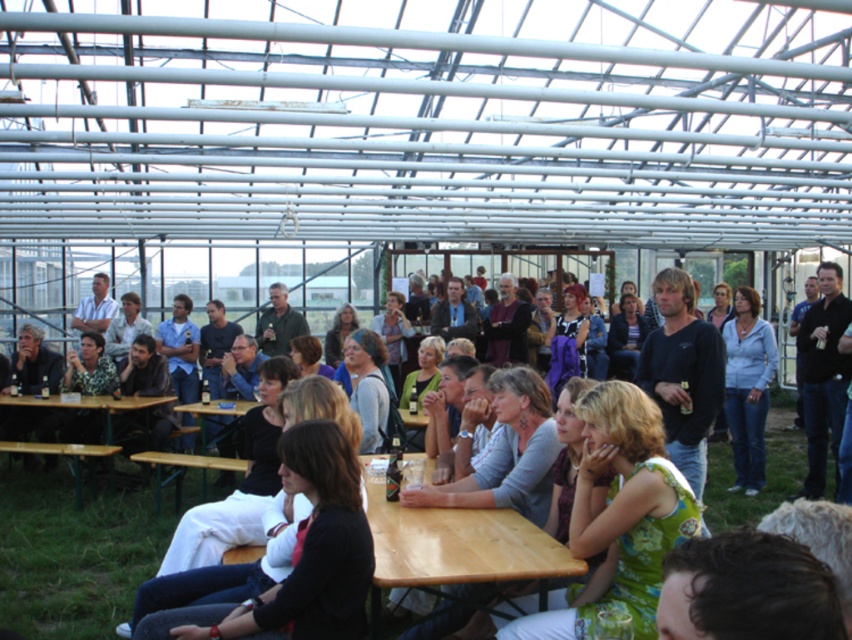
You are a server carrying a tray of drinks. You need to walk from the entrance of the structure to the wooden table at center. The path is clear except for a 2.5 meter wide flower bed. Can you reach the table without stepping into the flower bed?

The distance between the entrance and the wooden table at center is 2.63 meters. Since the flower bed is 2.5 meters wide, you can navigate around it and still reach the table.

You are a photographer standing at the back of the gathering area. You want to take a photo that includes both the wooden table at center and the wooden picnic table at lower left. Which table should you move closer to in order to capture both in focus without adjusting your camera settings?

You should move closer to the wooden picnic table at lower left because the wooden table at center is closer to the viewer, so adjusting your position to be nearer to the farther table would help ensure both are in focus.

You are at an outdoor gathering and want to move from the wooden picnic table at lower left to the wooden table at center. Which direction should you walk to get there?

To move from the wooden picnic table at lower left to the wooden table at center, you should walk to the right since the wooden table at center is located to the right of the wooden picnic table at lower left.